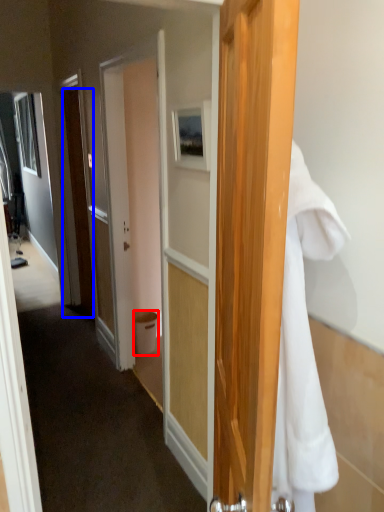
Question: Which of the following is the closest to the observer, trash bin/can (highlighted by a red box) or door (highlighted by a blue box)?

Choices:
 (A) trash bin/can
 (B) door

Answer: (B)